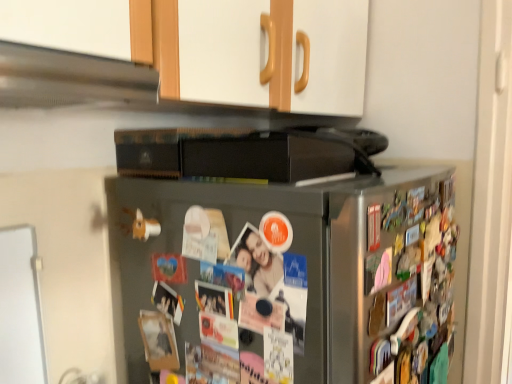
Describe the element at coordinates (70, 78) in the screenshot. I see `satin silver exhaust hood at upper left` at that location.

I want to click on satin silver exhaust hood at upper left, so click(x=70, y=78).

This screenshot has height=384, width=512. I want to click on satin silver refrigerator at center, so click(287, 278).

The width and height of the screenshot is (512, 384). Describe the element at coordinates (287, 278) in the screenshot. I see `satin silver refrigerator at center` at that location.

In order to click on satin silver exhaust hood at upper left in this screenshot , I will do `click(70, 78)`.

Considering the relative positions of satin silver refrigerator at center and satin silver exhaust hood at upper left in the image provided, is satin silver refrigerator at center to the right of satin silver exhaust hood at upper left from the viewer's perspective?

Indeed, satin silver refrigerator at center is positioned on the right side of satin silver exhaust hood at upper left.

In the image, is satin silver refrigerator at center positioned in front of or behind satin silver exhaust hood at upper left?

Visually, satin silver refrigerator at center is located behind satin silver exhaust hood at upper left.

Does point (211, 331) lie in front of point (137, 94)?

That is False.

From the image's perspective, is satin silver refrigerator at center under satin silver exhaust hood at upper left?

Yes, from the image's perspective, satin silver refrigerator at center is below satin silver exhaust hood at upper left.

Consider the image. From a real-world perspective, is satin silver refrigerator at center above or below satin silver exhaust hood at upper left?

In terms of real-world spatial position, satin silver refrigerator at center is below satin silver exhaust hood at upper left.

Is satin silver refrigerator at center wider than satin silver exhaust hood at upper left?

Correct, the width of satin silver refrigerator at center exceeds that of satin silver exhaust hood at upper left.

Between satin silver refrigerator at center and satin silver exhaust hood at upper left, which one has less height?

satin silver exhaust hood at upper left.

Which of these two, satin silver refrigerator at center or satin silver exhaust hood at upper left, is smaller?

With smaller size is satin silver exhaust hood at upper left.

Would you say satin silver refrigerator at center contains satin silver exhaust hood at upper left?

No, satin silver exhaust hood at upper left is not surrounded by satin silver refrigerator at center.

Is satin silver refrigerator at center positioned far away from satin silver exhaust hood at upper left?

That's not correct — satin silver refrigerator at center is a little close to satin silver exhaust hood at upper left.

Is satin silver refrigerator at center aimed at satin silver exhaust hood at upper left?

No, satin silver refrigerator at center is not aimed at satin silver exhaust hood at upper left.

How many degrees apart are the facing directions of satin silver refrigerator at center and satin silver exhaust hood at upper left?

0.175 degrees.

Measure the distance between satin silver refrigerator at center and satin silver exhaust hood at upper left.

A distance of 14.17 inches exists between satin silver refrigerator at center and satin silver exhaust hood at upper left.

You are a GUI agent. You are given a task and a screenshot of the screen. Output one action in this format:
    pyautogui.click(x=<x>, y=<y>)
    Task: Click on the refrigerator lying on the right of satin silver exhaust hood at upper left
    This screenshot has height=384, width=512.
    Given the screenshot: What is the action you would take?
    pyautogui.click(x=287, y=278)

Looking at this image, considering the positions of objects satin silver exhaust hood at upper left and satin silver refrigerator at center in the image provided, who is more to the left, satin silver exhaust hood at upper left or satin silver refrigerator at center?

From the viewer's perspective, satin silver exhaust hood at upper left appears more on the left side.

Does satin silver exhaust hood at upper left come in front of satin silver refrigerator at center?

Yes, it is in front of satin silver refrigerator at center.

Which is closer to the camera, (95, 79) or (231, 200)?

Point (95, 79).

From the image's perspective, which one is positioned lower, satin silver exhaust hood at upper left or satin silver refrigerator at center?

satin silver refrigerator at center is shown below in the image.

From a real-world perspective, is satin silver exhaust hood at upper left physically located above or below satin silver refrigerator at center?

In terms of real-world spatial position, satin silver exhaust hood at upper left is above satin silver refrigerator at center.

Can you confirm if satin silver exhaust hood at upper left is thinner than satin silver refrigerator at center?

Indeed, satin silver exhaust hood at upper left has a lesser width compared to satin silver refrigerator at center.

Is satin silver exhaust hood at upper left shorter than satin silver refrigerator at center?

Yes, satin silver exhaust hood at upper left is shorter than satin silver refrigerator at center.

Which of these two, satin silver exhaust hood at upper left or satin silver refrigerator at center, is bigger?

With larger size is satin silver refrigerator at center.

Would you say satin silver exhaust hood at upper left contains satin silver refrigerator at center?

No, satin silver refrigerator at center is located outside of satin silver exhaust hood at upper left.

Is satin silver exhaust hood at upper left far from satin silver refrigerator at center?

No, satin silver exhaust hood at upper left is not far from satin silver refrigerator at center.

Is satin silver exhaust hood at upper left facing away from satin silver refrigerator at center?

satin silver exhaust hood at upper left does not have its back to satin silver refrigerator at center.

Locate an element on the screen. refrigerator located below the satin silver exhaust hood at upper left (from the image's perspective) is located at coordinates (287, 278).

This screenshot has width=512, height=384. What are the coordinates of `exhaust hood in front of the satin silver refrigerator at center` in the screenshot? It's located at (70, 78).

Find the location of a particular element. refrigerator below the satin silver exhaust hood at upper left (from the image's perspective) is located at coordinates (287, 278).